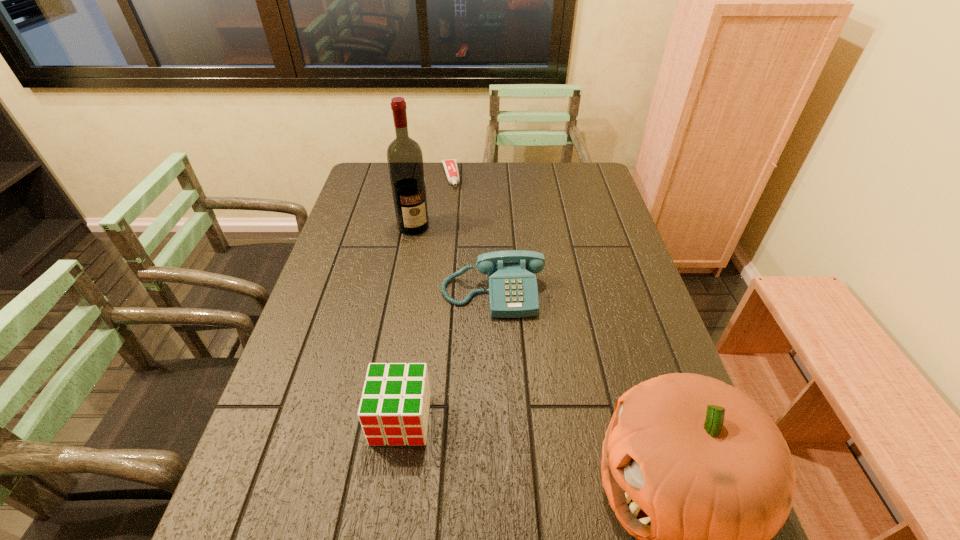
In the image, there is a desktop. In order to click on blank space at the near left corner in this screenshot , I will do `click(276, 456)`.

Locate an element on the screen. blank space at the far right corner is located at coordinates (588, 187).

The image size is (960, 540). I want to click on free space between the toothpaste and the third nearest object, so point(471,234).

Find the location of `free point between the cube and the third nearest object`. free point between the cube and the third nearest object is located at coordinates (446, 356).

Where is `free space that is in between the farthest object and the cube`? free space that is in between the farthest object and the cube is located at coordinates (425, 298).

Find the location of a particular element. This screenshot has height=540, width=960. free spot between the cube and the shortest object is located at coordinates (425, 298).

The image size is (960, 540). What are the coordinates of `unoccupied position between the cube and the shortest object` in the screenshot? It's located at click(425, 298).

Where is `free space between the telephone and the cube`? This screenshot has height=540, width=960. free space between the telephone and the cube is located at coordinates (446, 356).

Where is `object that can be found as the closest to the toothpaste`? Image resolution: width=960 pixels, height=540 pixels. object that can be found as the closest to the toothpaste is located at coordinates click(404, 155).

At what (x,y) coordinates should I click in order to perform the action: click on object identified as the closest to the third farthest object. Please return your answer as a coordinate pair (x, y). This screenshot has height=540, width=960. Looking at the image, I should click on (404, 155).